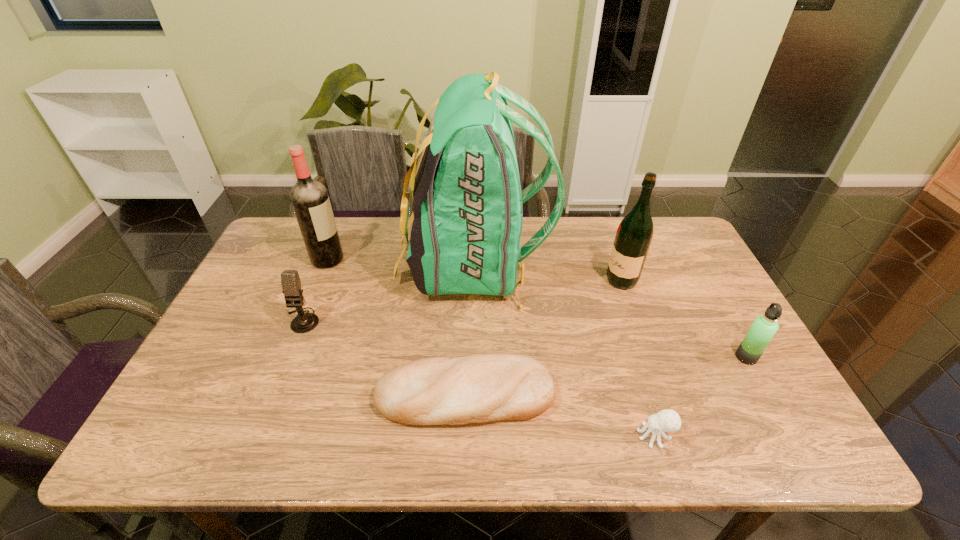
This screenshot has height=540, width=960. In order to click on free space that satisfies the following two spatial constraints: 1. on the front-facing side of the thermos bottle; 2. on the right side of the microphone in this screenshot , I will do `click(288, 357)`.

You are a GUI agent. You are given a task and a screenshot of the screen. Output one action in this format:
    pyautogui.click(x=<x>, y=<y>)
    Task: Click on the free spot that satisfies the following two spatial constraints: 1. on the front side of the thermos bottle; 2. on the front-facing side of the octopus
    Image resolution: width=960 pixels, height=540 pixels.
    Given the screenshot: What is the action you would take?
    pyautogui.click(x=790, y=436)